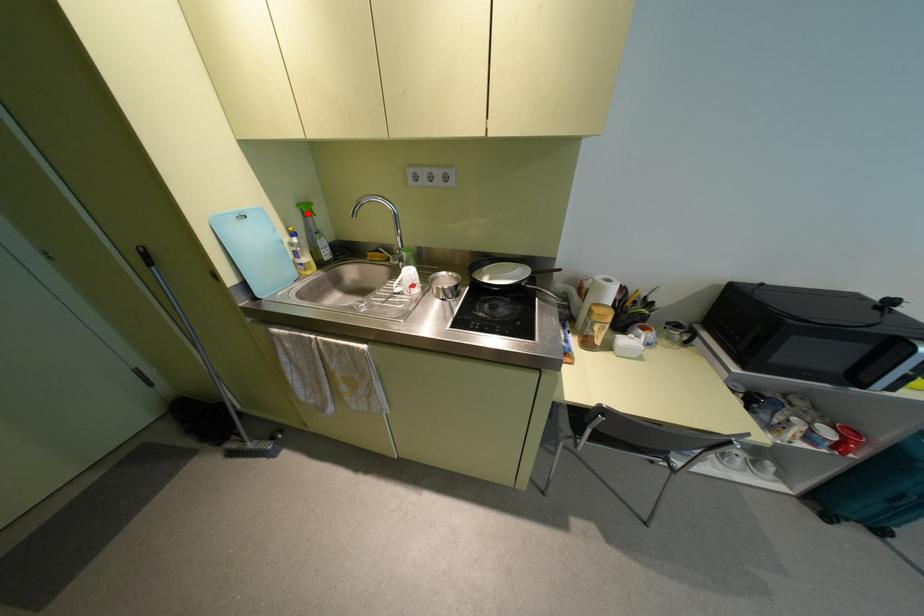
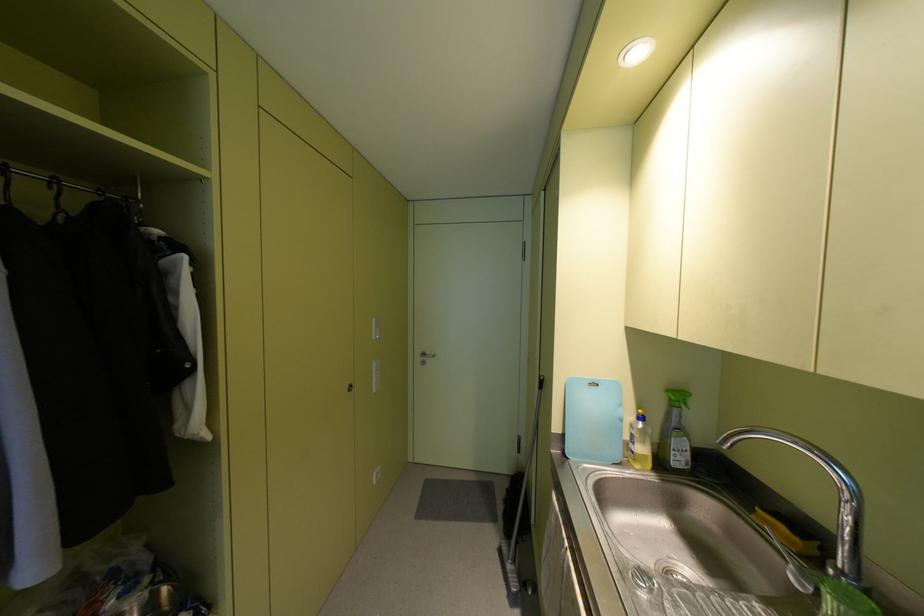
Question: I am providing you with two images of the same scene from different viewpoints. Image1 has a red point marked. In image2, the corresponding 3D location appears at what relative position? Reply with the corresponding letter.

Choices:
 (A) Closer
 (B) Farther

Answer: (B)